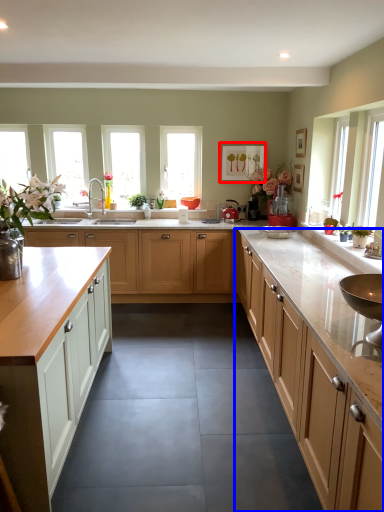
Question: Which object is further to the camera taking this photo, picture frame (highlighted by a red box) or cabinetry (highlighted by a blue box)?

Choices:
 (A) picture frame
 (B) cabinetry

Answer: (A)